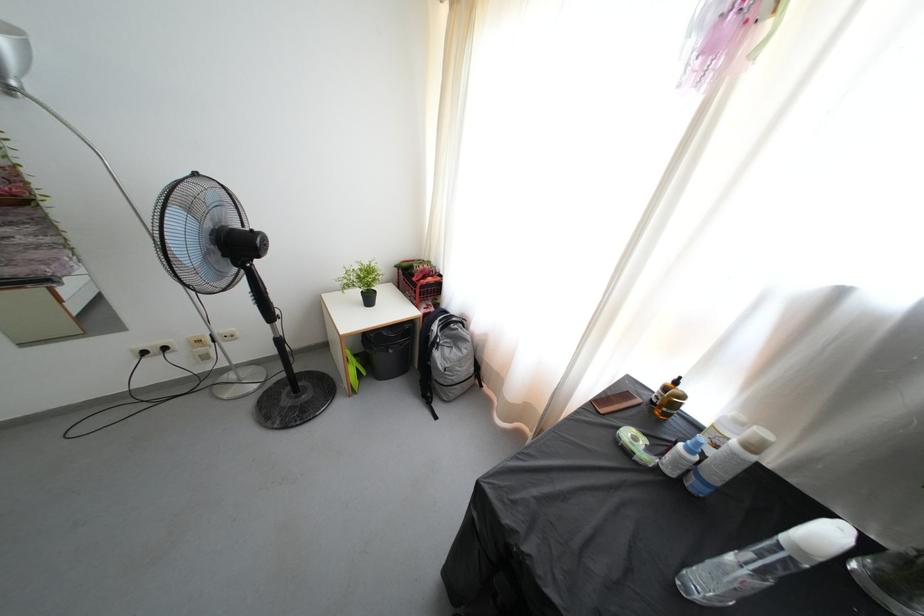
Where would you push the fan control buttons? Please return your answer as a coordinate pair (x, y).

(636, 446)